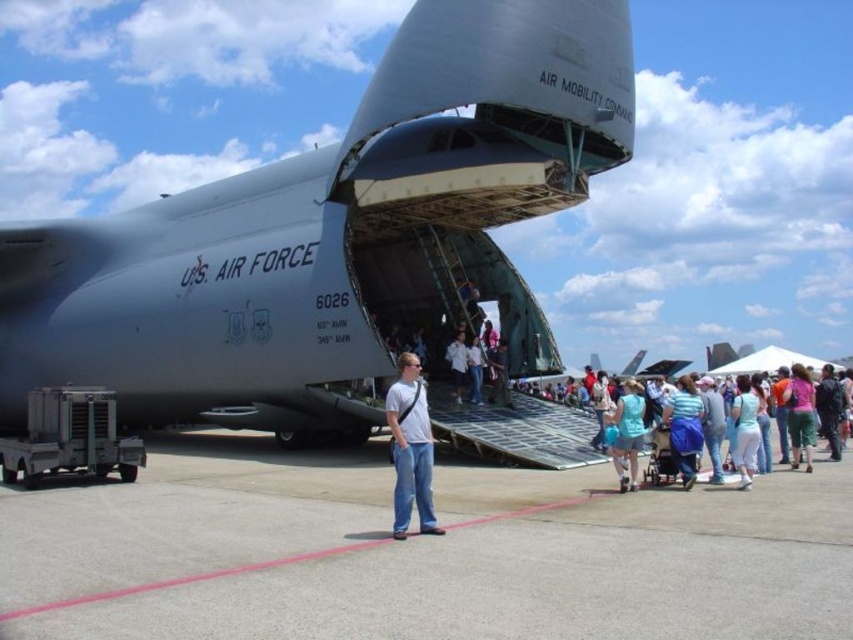
You are a drone operator tasked with positioning a drone to capture a photo of the matte gray airplane at center. The drone must be placed at coordinates that are 0.1 units to the right and 0.05 units above the airplane. What are the coordinates where the drone should be positioned?

The drone should be positioned at coordinates 0.367 plus 0.1 equals 0.467 in the x coordinate and 0.392 plus 0.05 equals 0.442 in the y coordinate. So the coordinates are (376, 298).

You are a photographer standing at the location of the light blue fabric dress at center. You want to take a photo of the matte gray airplane at center. Given that your camera has a maximum zoom range of 100 meters, can you capture the entire airplane in the frame without moving closer?

The distance between the matte gray airplane at center and the light blue fabric dress at center is 39.67 meters, which is within the camera maximum zoom range of 100 meters. Therefore, you can capture the entire airplane in the frame without moving closer.

You are standing at point (334, 234) on the image. What object are you standing on?

You are standing on the matte gray airplane at center located at point (334, 234).